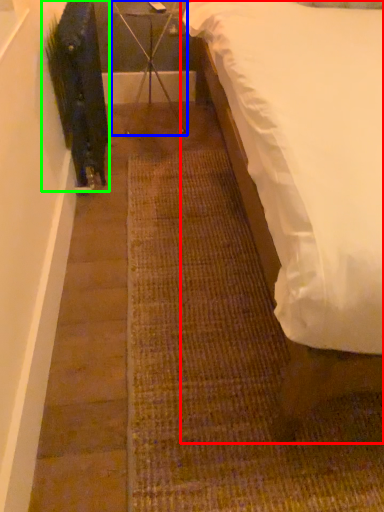
Question: Which is farther away from bed (highlighted by a red box)? furniture (highlighted by a blue box) or plant (highlighted by a green box)?

Choices:
 (A) furniture
 (B) plant

Answer: (A)